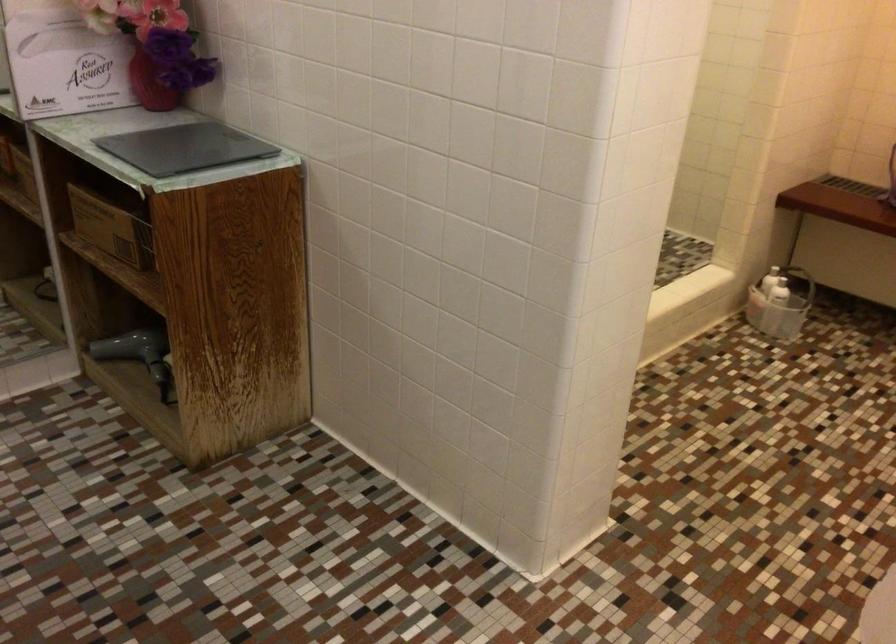
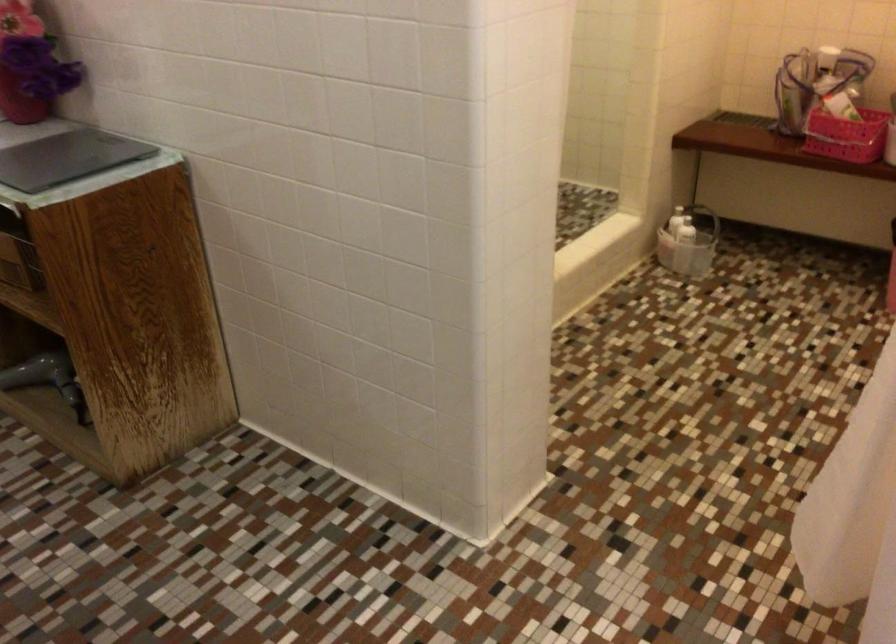
Question: The camera is either moving clockwise (left) or counter-clockwise (right) around the object. The first image is from the beginning of the video and the second image is from the end. Is the camera moving left or right when shooting the video?

Choices:
 (A) Left
 (B) Right

Answer: (A)